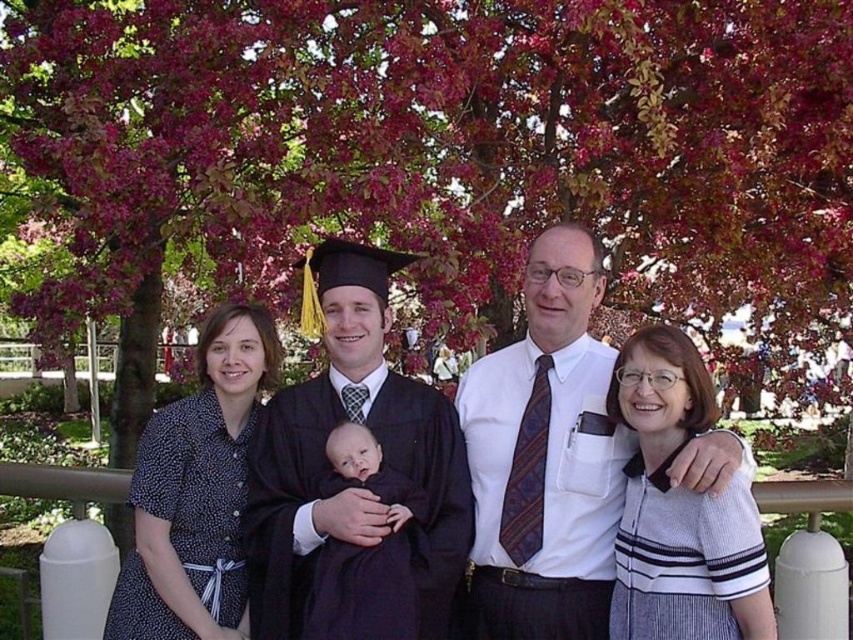
Image resolution: width=853 pixels, height=640 pixels. Describe the element at coordinates (364, 552) in the screenshot. I see `dark blue fabric baby at center` at that location.

Does dark blue fabric baby at center have a lesser height compared to smooth dark fabric baby at center?

No.

Between point (334, 458) and point (361, 474), which one is positioned in front?

Point (361, 474) is more forward.

Image resolution: width=853 pixels, height=640 pixels. Find the location of `dark blue fabric baby at center`. dark blue fabric baby at center is located at coordinates (364, 552).

Does matte black graduation gown at center lie in front of smooth dark fabric baby at center?

Yes, it is in front of smooth dark fabric baby at center.

Image resolution: width=853 pixels, height=640 pixels. I want to click on matte black graduation gown at center, so click(x=381, y=458).

The image size is (853, 640). I want to click on matte black graduation gown at center, so click(x=381, y=458).

Does black dotted dress at left have a greater height compared to dark blue fabric baby at center?

Correct, black dotted dress at left is much taller as dark blue fabric baby at center.

Is black dotted dress at left thinner than dark blue fabric baby at center?

No.

Which is in front, point (186, 573) or point (320, 570)?

Point (320, 570)

Locate an element on the screen. The height and width of the screenshot is (640, 853). black dotted dress at left is located at coordinates (196, 492).